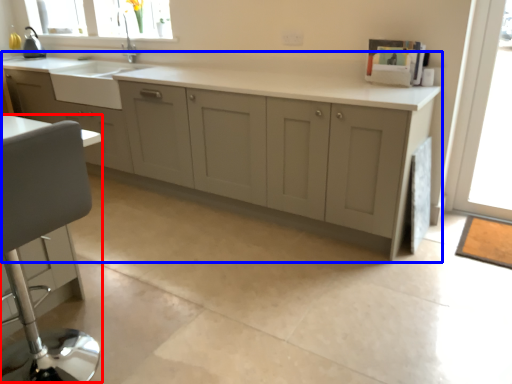
Question: Which of the following is the closest to the observer, swivel chair (highlighted by a red box) or cabinetry (highlighted by a blue box)?

Choices:
 (A) swivel chair
 (B) cabinetry

Answer: (A)